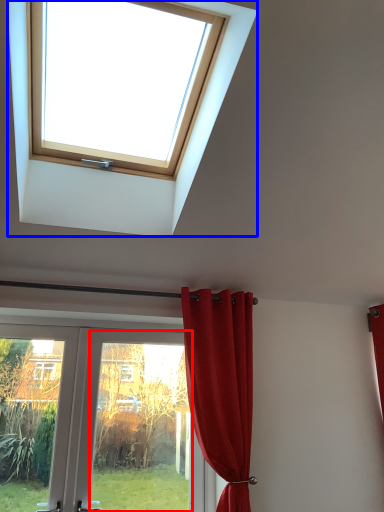
Question: Which point is closer to the camera, glass door (highlighted by a red box) or window (highlighted by a blue box)?

Choices:
 (A) glass door
 (B) window

Answer: (B)